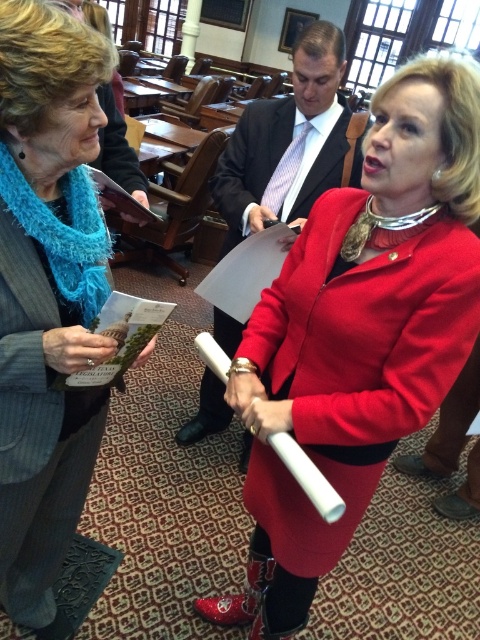
You are standing in the room and want to locate the matte red coat at center. According to the coordinates provided, where should you look?

The matte red coat at center is located at coordinates point (359, 333).

You are standing in the room and want to find the matte red coat at center. According to the coordinates provided, where should you look relative to the room?

The matte red coat at center is located at coordinates point 0.522 on the x axis and 0.748 on the y axis, so you should look towards the center right area of the room.

You are an interior designer assessing the spatial dimensions of the room. You notice the matte blue scarf at left and the matte black suit at center. Which object has a smaller width?

The matte blue scarf at left has a smaller width than the matte black suit at center because the description states it is thinner.